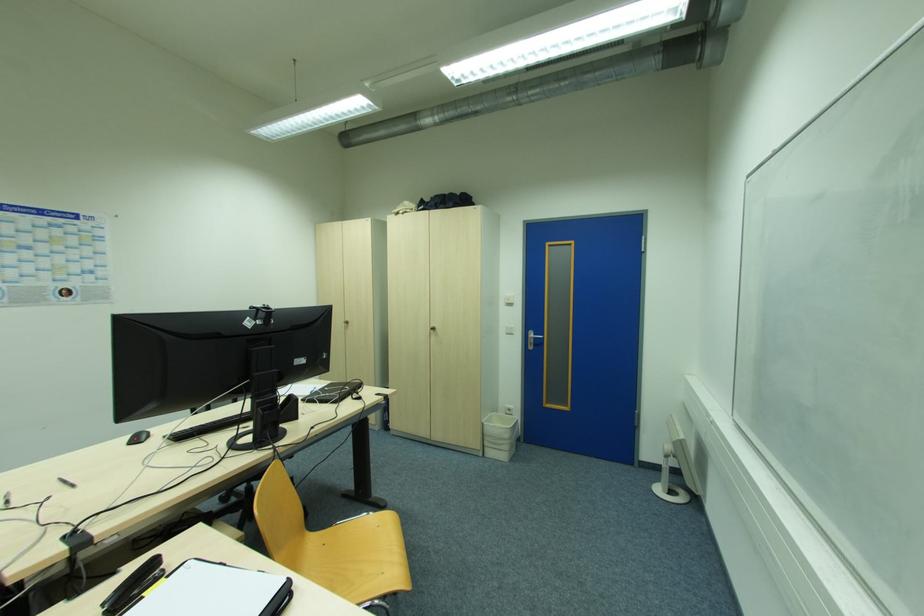
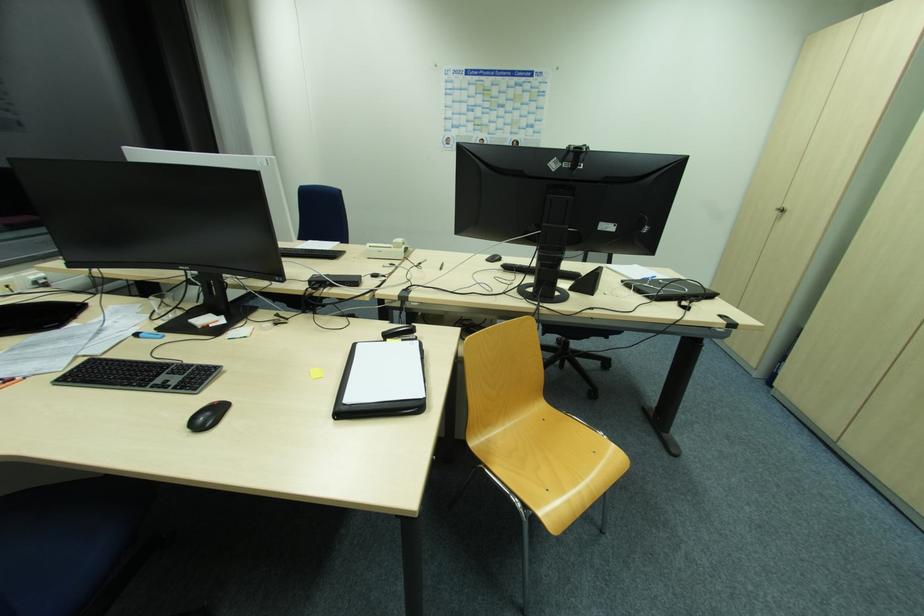
Find the pixel in the second image that matches the point at 250,318 in the first image.

(557, 159)